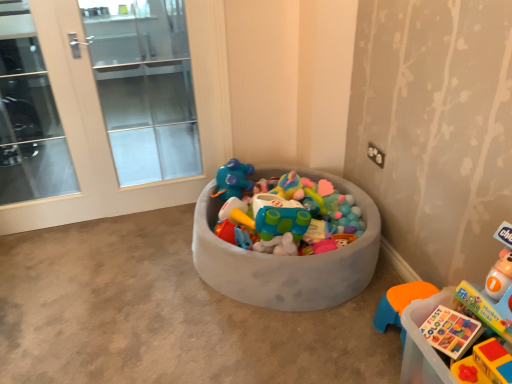
I want to click on blank space situated above gray fabric toy bin at center (from a real-world perspective), so click(147, 292).